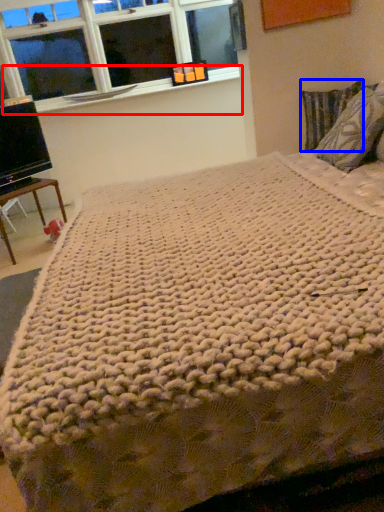
Question: Among these objects, which one is farthest to the camera, window sill (highlighted by a red box) or pillow (highlighted by a blue box)?

Choices:
 (A) window sill
 (B) pillow

Answer: (A)